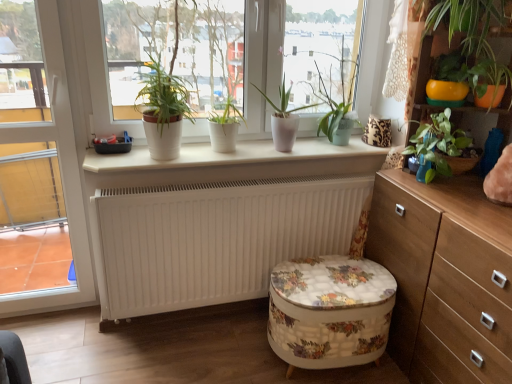
You are a GUI agent. You are given a task and a screenshot of the screen. Output one action in this format:
    pyautogui.click(x=<x>, y=<y>)
    Task: Click on the vacant area that is situated to the right of white glossy door at left
    
    Given the screenshot: What is the action you would take?
    pyautogui.click(x=84, y=333)